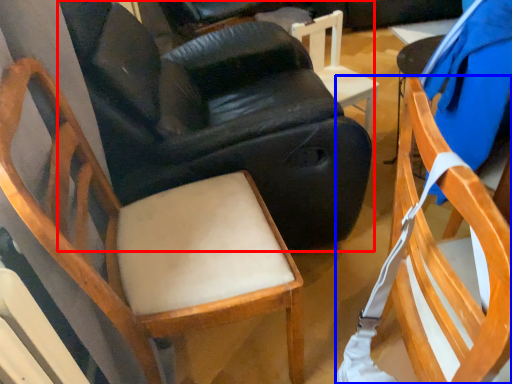
Question: Which object is further to the camera taking this photo, chair (highlighted by a red box) or chair (highlighted by a blue box)?

Choices:
 (A) chair
 (B) chair

Answer: (A)